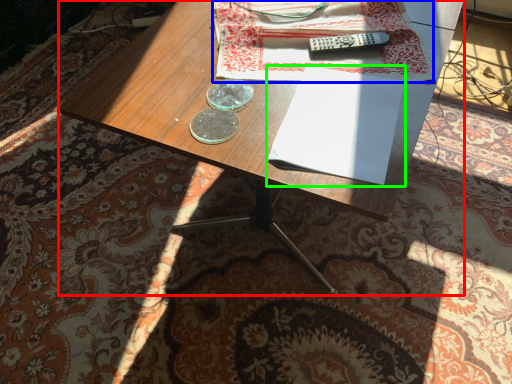
Question: Estimate the real-world distances between objects in this image. Which object is farther from desk (highlighted by a red box), sheet (highlighted by a blue box) or paperback book (highlighted by a green box)?

Choices:
 (A) sheet
 (B) paperback book

Answer: (B)